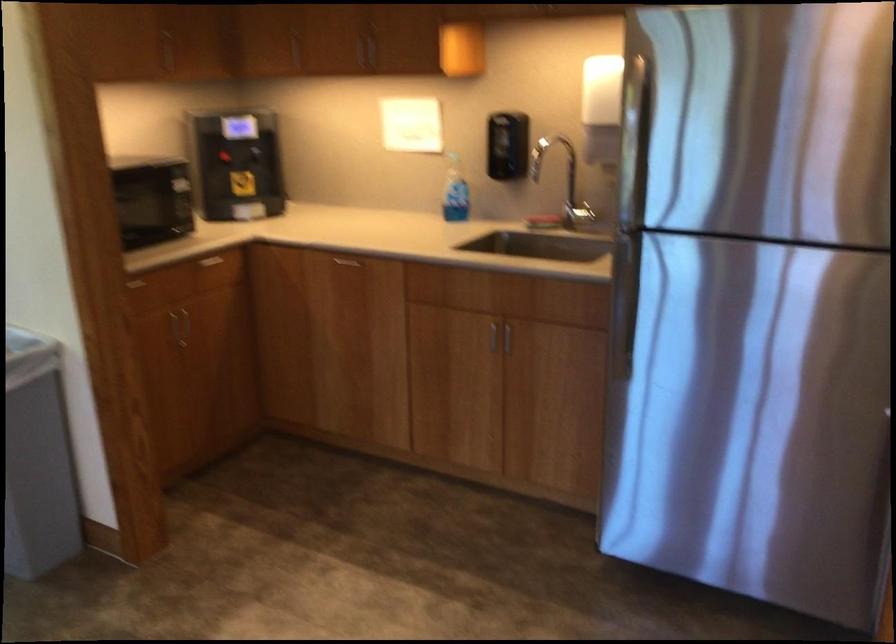
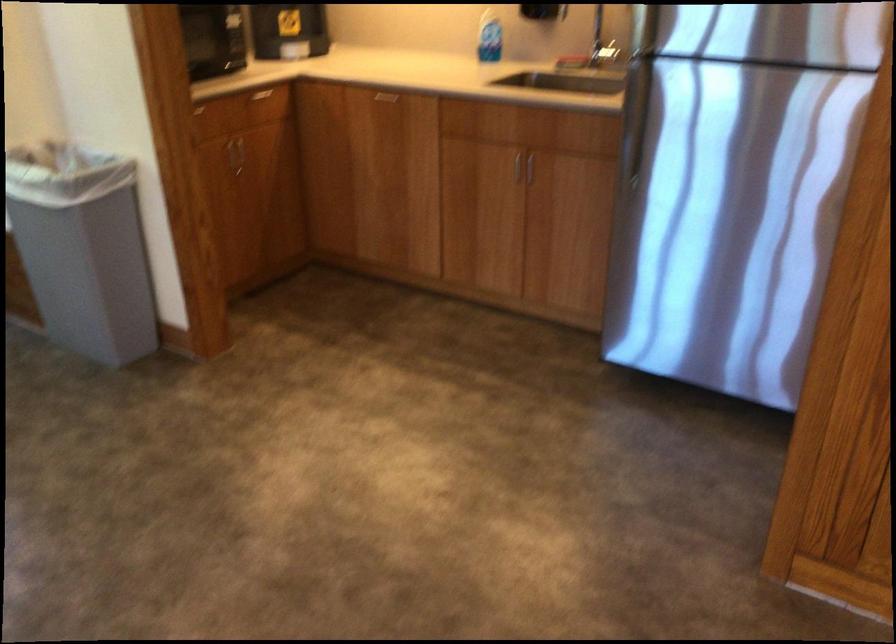
Where in the second image is the point corresponding to [177,323] from the first image?

(234, 153)